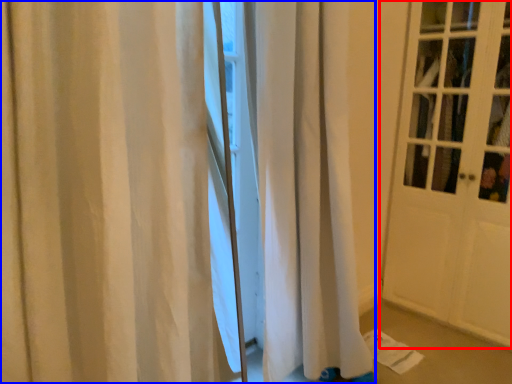
Question: Which object appears farthest to the camera in this image, door (highlighted by a red box) or curtain (highlighted by a blue box)?

Choices:
 (A) door
 (B) curtain

Answer: (A)